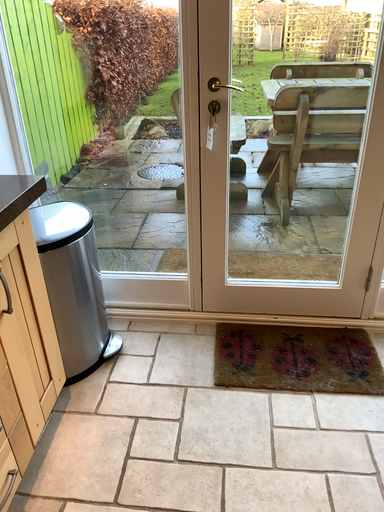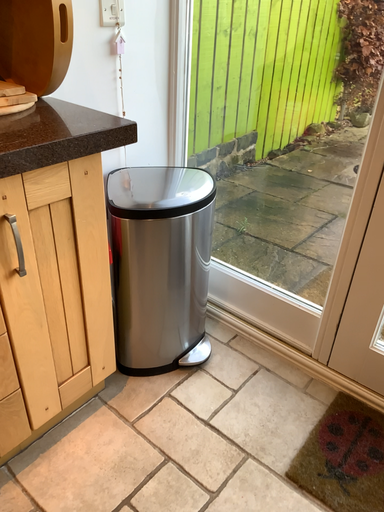
Question: How did the camera likely rotate when shooting the video?

Choices:
 (A) rotated left
 (B) rotated right

Answer: (A)